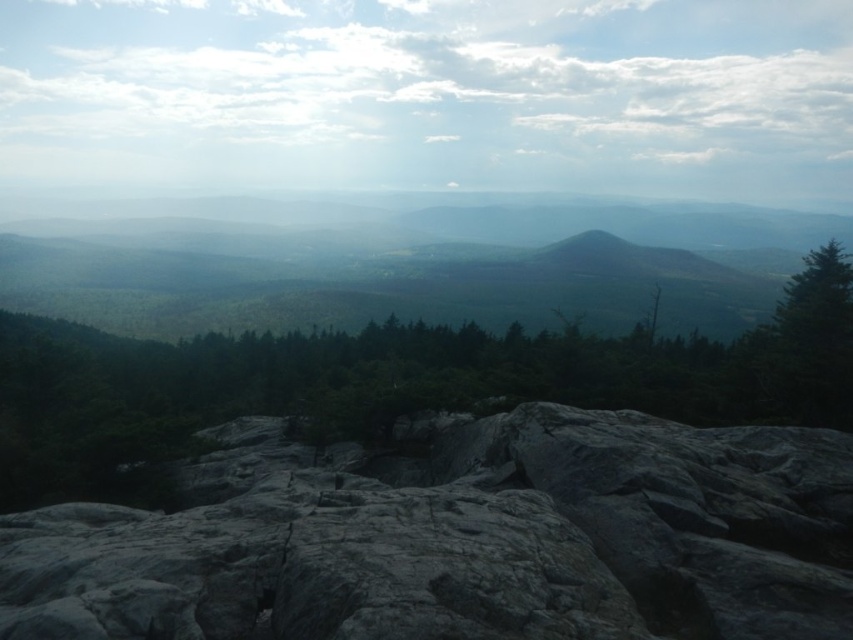
Question: Is gray rough rock at center below green matte tree at center?

Choices:
 (A) yes
 (B) no

Answer: (A)

Question: Is gray rough rock at center above green matte tree at center?

Choices:
 (A) no
 (B) yes

Answer: (A)

Question: Which of the following is the closest to the observer?

Choices:
 (A) (428, 563)
 (B) (47, 424)

Answer: (A)

Question: Does gray rough rock at center appear over green matte tree at center?

Choices:
 (A) yes
 (B) no

Answer: (B)

Question: Which point is farther to the camera?

Choices:
 (A) (86, 353)
 (B) (569, 460)

Answer: (A)